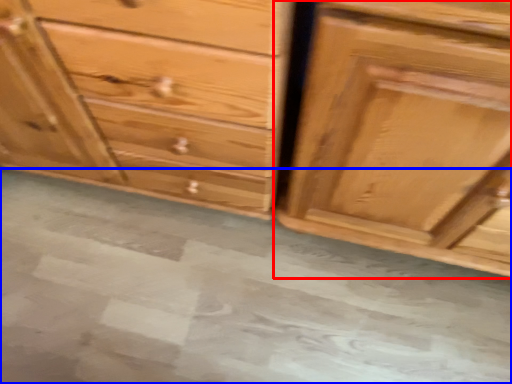
Question: Among these objects, which one is nearest to the camera, chest of drawers (highlighted by a red box) or concrete (highlighted by a blue box)?

Choices:
 (A) chest of drawers
 (B) concrete

Answer: (A)